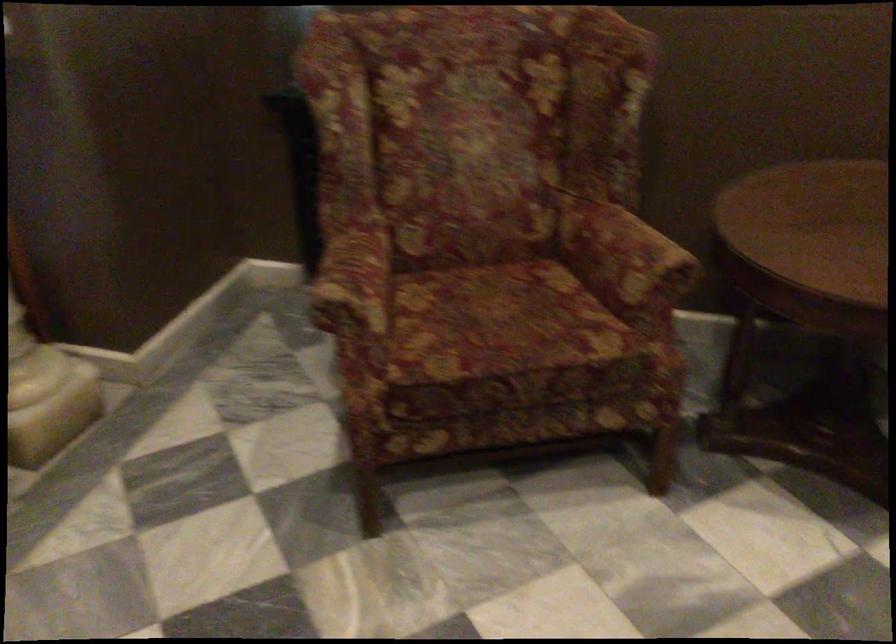
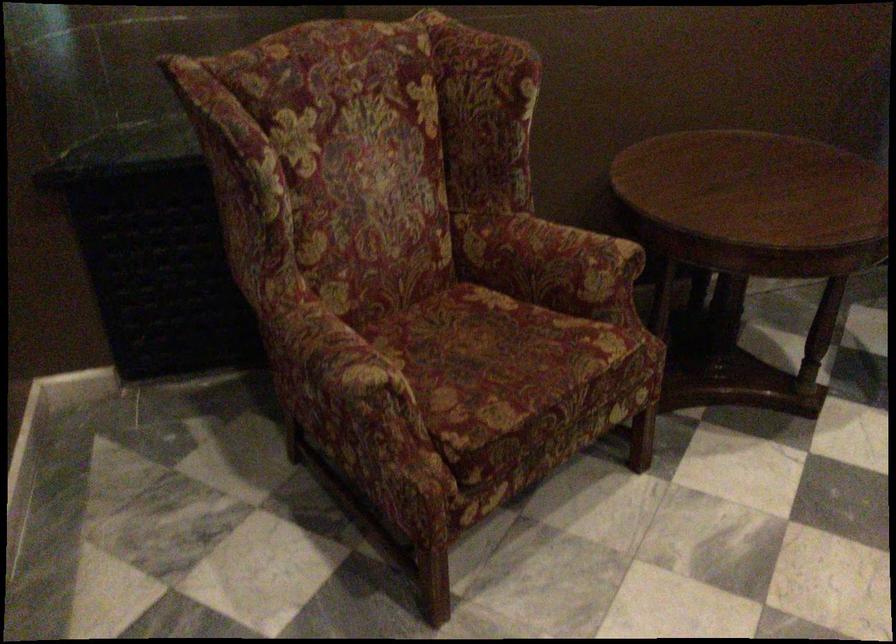
Locate, in the second image, the point that corresponds to [625,252] in the first image.

(572, 256)